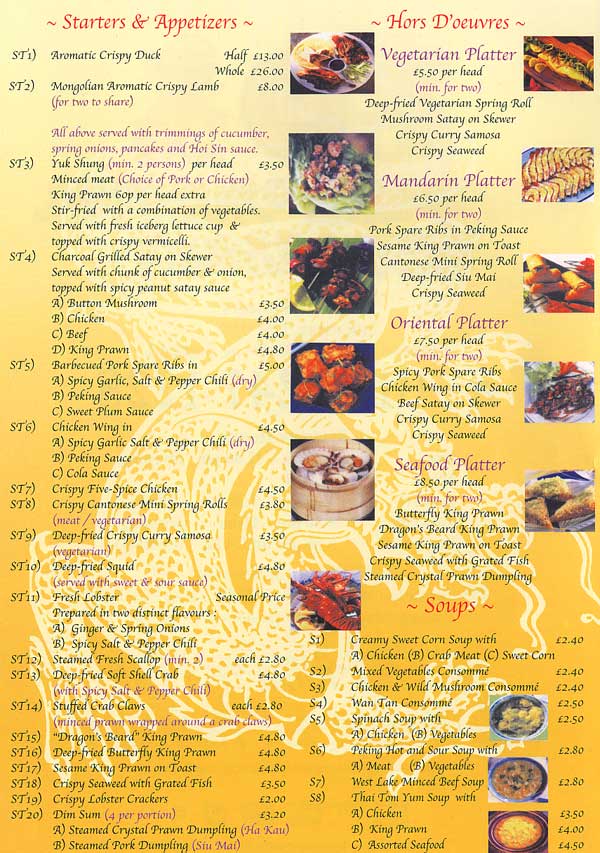
Locate an element on the screen. oriental platter is located at coordinates (442, 339), (447, 369), (446, 387), (447, 404), (448, 415), (448, 438).